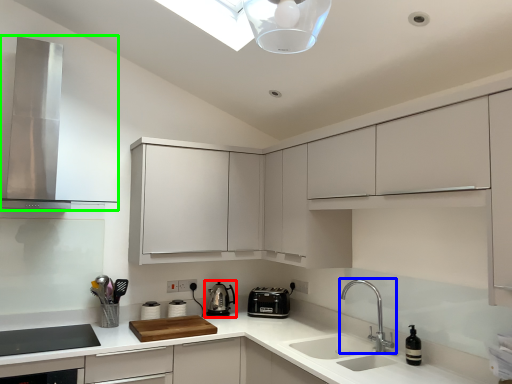
Question: Which is nearer to the kitchen appliance (highlighted by a red box)? tap (highlighted by a blue box) or home appliance (highlighted by a green box).

Choices:
 (A) tap
 (B) home appliance

Answer: (A)